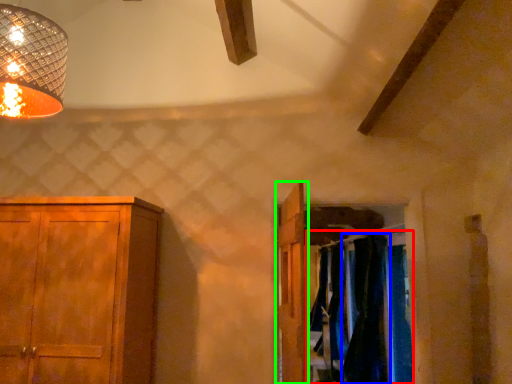
Question: Considering the real-world distances, which object is farthest from laundry (highlighted by a red box)? curtain (highlighted by a blue box) or door (highlighted by a green box)?

Choices:
 (A) curtain
 (B) door

Answer: (B)